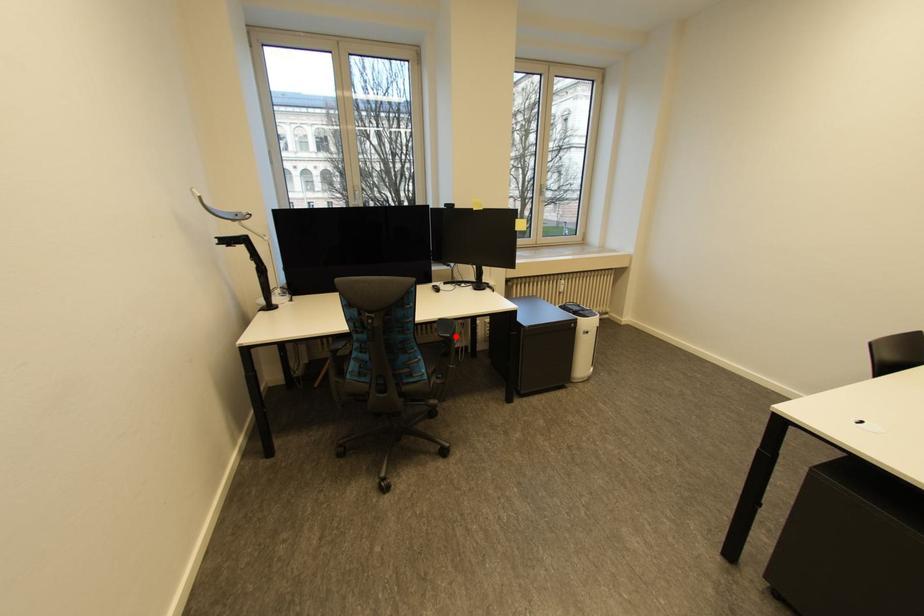
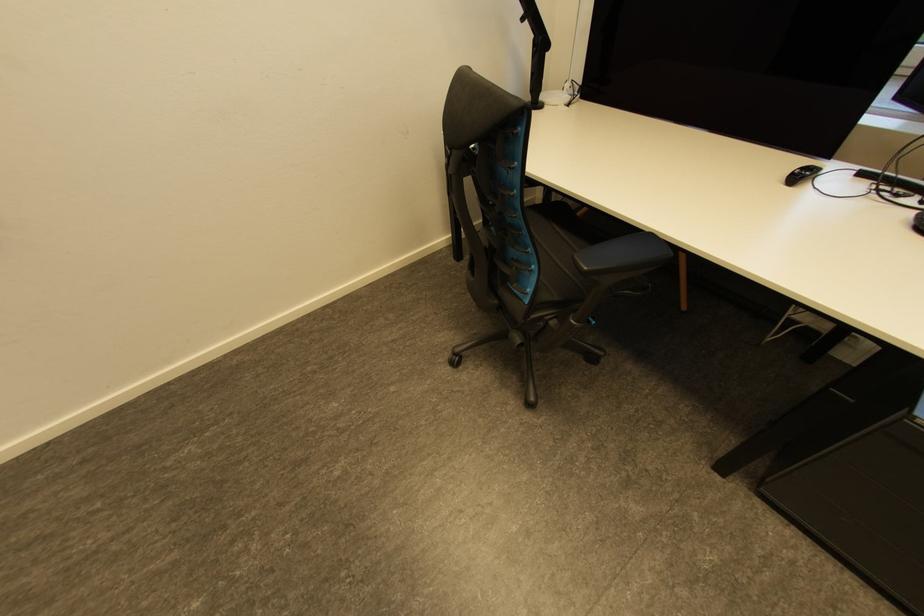
Question: I am providing you with two images of the same scene from different viewpoints. Given a red point in image1, look at the same physical point in image2. Is it:

Choices:
 (A) Closer to the viewpoint
 (B) Farther from the viewpoint

Answer: (B)